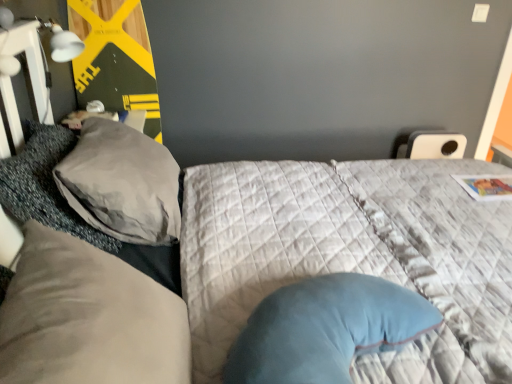
Question: Would you consider gray textured pillow at left, which is the second pillow in front-to-back order, to be distant from matte yellow wood board at upper left?

Choices:
 (A) yes
 (B) no

Answer: (B)

Question: Does gray textured pillow at left, which is the second pillow in front-to-back order, have a smaller size compared to matte yellow wood board at upper left?

Choices:
 (A) yes
 (B) no

Answer: (A)

Question: Could you tell me if gray textured pillow at left, which is the second pillow in front-to-back order, is facing matte yellow wood board at upper left?

Choices:
 (A) no
 (B) yes

Answer: (A)

Question: Is gray textured pillow at left, the second pillow positioned from the back, in contact with matte yellow wood board at upper left?

Choices:
 (A) yes
 (B) no

Answer: (B)

Question: Can you confirm if gray textured pillow at left, which is the second pillow in front-to-back order, is positioned to the left of matte yellow wood board at upper left?

Choices:
 (A) yes
 (B) no

Answer: (B)

Question: Considering the positions of point (167, 231) and point (100, 331), is point (167, 231) closer or farther from the camera than point (100, 331)?

Choices:
 (A) farther
 (B) closer

Answer: (A)

Question: From a real-world perspective, is gray fabric pillow at left, which appears as the third pillow when viewed from the front, physically located above or below suede-like beige pillow at left, the first pillow from the front?

Choices:
 (A) below
 (B) above

Answer: (A)

Question: From the image's perspective, is gray fabric pillow at left, the first pillow in the back-to-front sequence, positioned above or below suede-like beige pillow at left, which is the third pillow in back-to-front order?

Choices:
 (A) above
 (B) below

Answer: (A)

Question: In terms of width, does gray fabric pillow at left, the first pillow in the back-to-front sequence, look wider or thinner when compared to suede-like beige pillow at left, the first pillow from the front?

Choices:
 (A) thin
 (B) wide

Answer: (B)

Question: Is point (152, 352) closer or farther from the camera than point (104, 135)?

Choices:
 (A) closer
 (B) farther

Answer: (A)

Question: From a real-world perspective, relative to gray fabric pillow at left, the first pillow in the back-to-front sequence, is suede-like beige pillow at left, the first pillow from the front, vertically above or below?

Choices:
 (A) below
 (B) above

Answer: (B)

Question: From the image's perspective, is suede-like beige pillow at left, which is the third pillow in back-to-front order, positioned above or below gray fabric pillow at left, which appears as the third pillow when viewed from the front?

Choices:
 (A) below
 (B) above

Answer: (A)

Question: Considering the positions of suede-like beige pillow at left, the first pillow from the front, and gray fabric pillow at left, the first pillow in the back-to-front sequence, in the image, is suede-like beige pillow at left, the first pillow from the front, wider or thinner than gray fabric pillow at left, the first pillow in the back-to-front sequence,?

Choices:
 (A) wide
 (B) thin

Answer: (B)

Question: Considering the positions of gray textured pillow at left, which is the second pillow in front-to-back order, and velvety blue pillow at center in the image, is gray textured pillow at left, which is the second pillow in front-to-back order, bigger or smaller than velvety blue pillow at center?

Choices:
 (A) small
 (B) big

Answer: (A)

Question: Is gray textured pillow at left, the second pillow positioned from the back, to the left or to the right of velvety blue pillow at center in the image?

Choices:
 (A) right
 (B) left

Answer: (B)